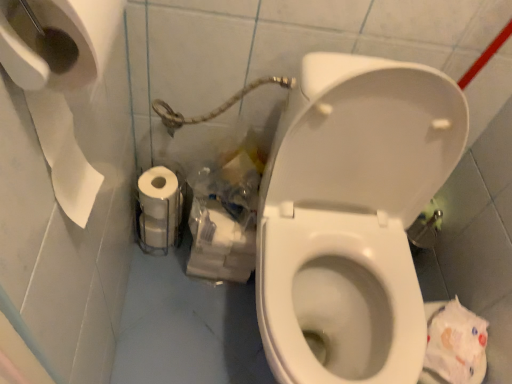
Identify the location of free space above translucent plastic bag at lower center (from a real-world perspective). This screenshot has width=512, height=384. 224,208.